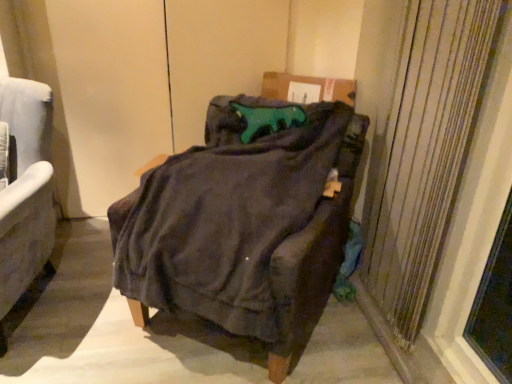
Question: Is velvet gray armchair at left, the second chair positioned from the right, in front of or behind textured beige curtain at right in the image?

Choices:
 (A) behind
 (B) front

Answer: (A)

Question: Considering the positions of velvet gray armchair at left, the first chair viewed from the left, and textured beige curtain at right in the image, is velvet gray armchair at left, the first chair viewed from the left, taller or shorter than textured beige curtain at right?

Choices:
 (A) short
 (B) tall

Answer: (A)

Question: Based on their relative distances, which object is nearer to the dark fabric chair at center, which is counted as the 1th chair, starting from the right?

Choices:
 (A) velvet gray armchair at left, the second chair positioned from the right
 (B) textured beige curtain at right

Answer: (B)

Question: Considering the real-world distances, which object is closest to the velvet gray armchair at left, the second chair positioned from the right?

Choices:
 (A) textured beige curtain at right
 (B) dark fabric chair at center, which ranks as the 2th chair in left-to-right order

Answer: (B)